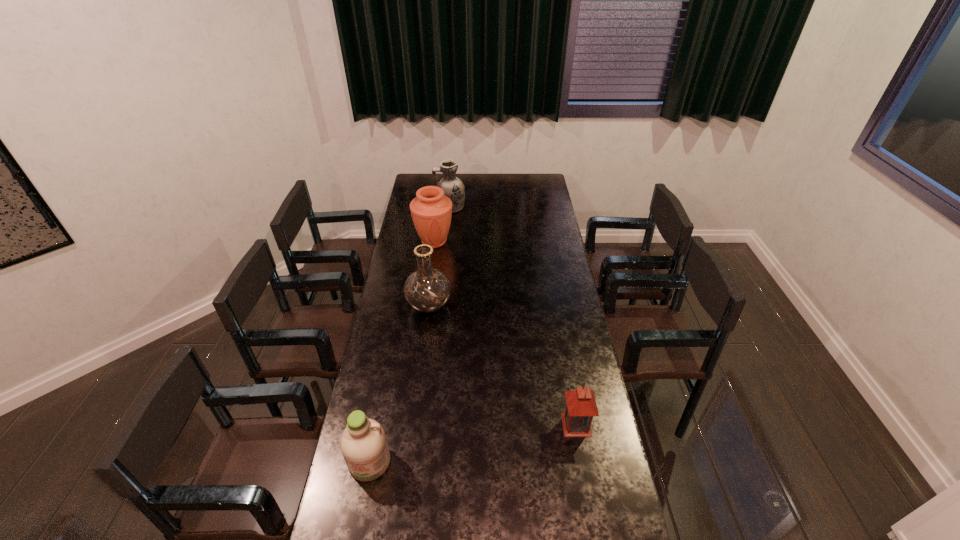
I want to click on the third nearest object, so click(x=427, y=290).

Find the location of a particular element. Image resolution: width=960 pixels, height=540 pixels. the second farthest vase is located at coordinates (431, 211).

I want to click on the farthest object, so click(453, 187).

Identify the location of the nearest object. (363, 443).

Identify the location of the fourth farthest object. The width and height of the screenshot is (960, 540). (581, 406).

You are a GUI agent. You are given a task and a screenshot of the screen. Output one action in this format:
    pyautogui.click(x=<x>, y=<y>)
    Task: Click on the rightmost object
    
    Given the screenshot: What is the action you would take?
    pyautogui.click(x=581, y=406)

Find the location of a particular element. The height and width of the screenshot is (540, 960). vacant space located on the right of the third farthest object is located at coordinates (519, 306).

Identify the location of vacant area situated 0.090m on the front of the fourth nearest object. This screenshot has height=540, width=960. (431, 266).

You are a GUI agent. You are given a task and a screenshot of the screen. Output one action in this format:
    pyautogui.click(x=<x>, y=<y>)
    Task: Click on the vacant space located 0.170m with the handle on the side of the farthest object
    This screenshot has width=960, height=540.
    Given the screenshot: What is the action you would take?
    pyautogui.click(x=406, y=207)

The width and height of the screenshot is (960, 540). I want to click on vacant space situated 0.110m with the handle on the side of the farthest object, so click(416, 207).